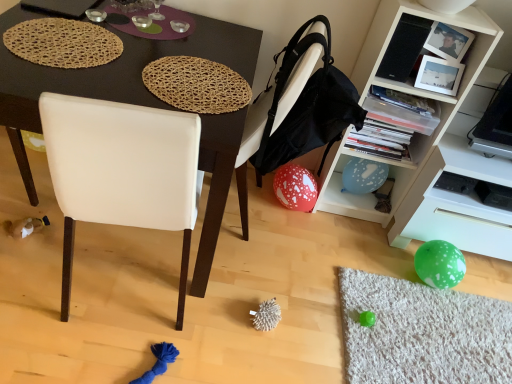
You are a GUI agent. You are given a task and a screenshot of the screen. Output one action in this format:
    pyautogui.click(x=<x>, y=<y>)
    Task: Click on the free space to the left of woven natural placemat at upper center, the first mat when ordered from right to left
    
    Given the screenshot: What is the action you would take?
    (x=101, y=54)